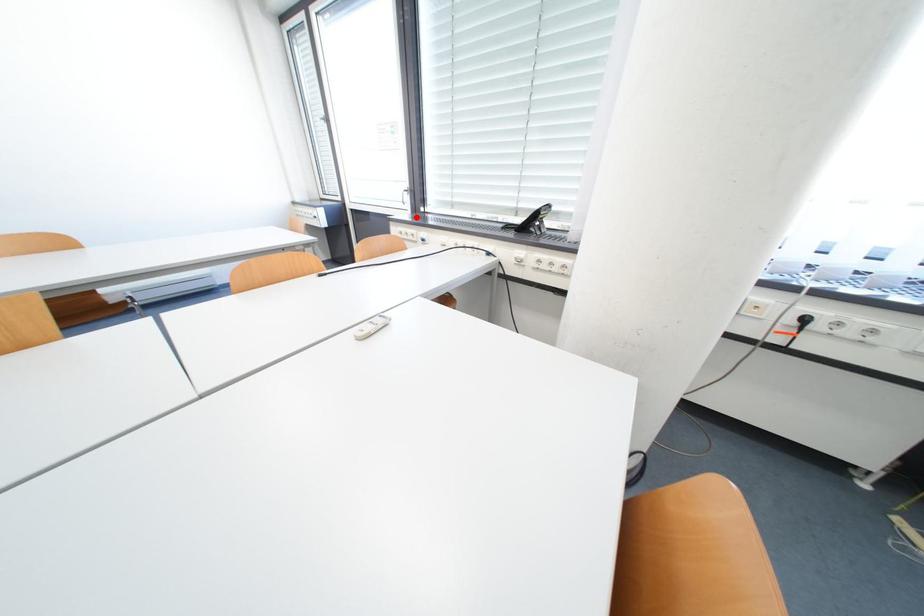
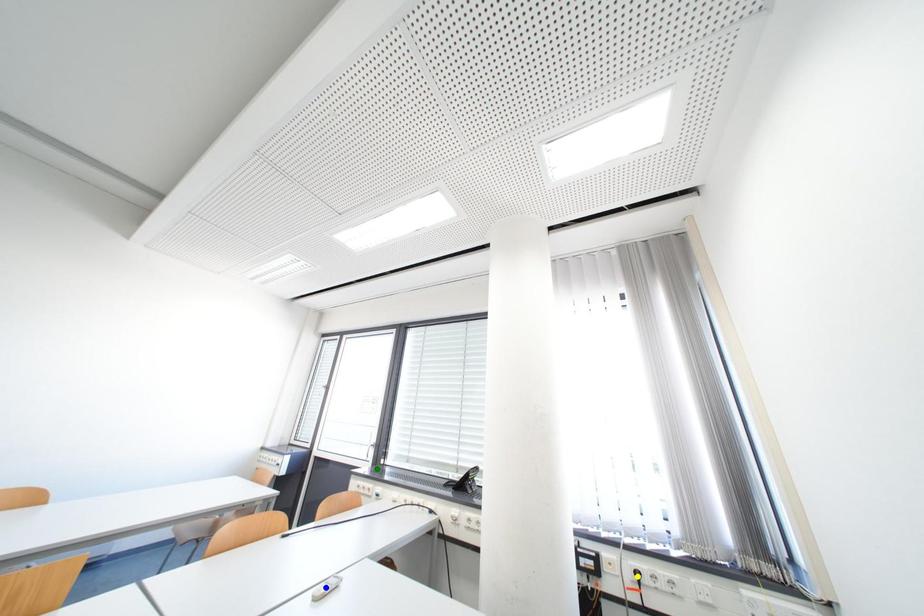
Question: I am providing you with two images of the same scene from different viewpoints. A red point is marked on the first image. You are given multiple points on the second image. Which point in image 2 represents the same 3d spot as the red point in image 1?

Choices:
 (A) yellow point
 (B) green point
 (C) blue point

Answer: (B)